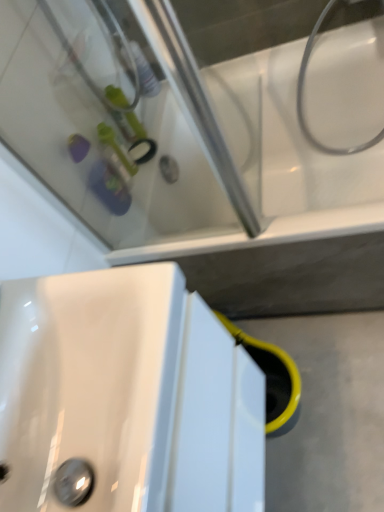
Image resolution: width=384 pixels, height=512 pixels. What do you see at coordinates (125, 397) in the screenshot? I see `white glossy sink at lower left` at bounding box center [125, 397].

What do you see at coordinates (202, 173) in the screenshot? The height and width of the screenshot is (512, 384). I see `white glossy bathtub at upper center` at bounding box center [202, 173].

Measure the distance between white glossy bathtub at upper center and camera.

white glossy bathtub at upper center is 34.36 inches away from camera.

I want to click on white glossy hose at upper right, so click(x=302, y=97).

Where is `white glossy sink at lower left`? white glossy sink at lower left is located at coordinates (125, 397).

Is white glossy bathtub at upper center oriented towards white glossy sink at lower left?

Yes.

From a real-world perspective, is white glossy bathtub at upper center positioned under white glossy sink at lower left based on gravity?

Yes, from a real-world perspective, white glossy bathtub at upper center is beneath white glossy sink at lower left.

Is white glossy bathtub at upper center not within white glossy sink at lower left?

Yes.

Which object is wider, white glossy bathtub at upper center or white glossy sink at lower left?

With larger width is white glossy bathtub at upper center.

You are a GUI agent. You are given a task and a screenshot of the screen. Output one action in this format:
    pyautogui.click(x=<x>, y=<y>)
    Task: Click on the plumbing fixture above the white glossy bathtub at upper center (from a real-world perspective)
    
    Given the screenshot: What is the action you would take?
    pyautogui.click(x=302, y=97)

Considering the sizes of objects white glossy hose at upper right and white glossy bathtub at upper center in the image provided, who is wider, white glossy hose at upper right or white glossy bathtub at upper center?

With larger width is white glossy bathtub at upper center.

From the picture: Considering the positions of objects white glossy hose at upper right and white glossy bathtub at upper center in the image provided, who is more to the left, white glossy hose at upper right or white glossy bathtub at upper center?

From the viewer's perspective, white glossy bathtub at upper center appears more on the left side.

From the image's perspective, which is below, white glossy hose at upper right or white glossy bathtub at upper center?

white glossy bathtub at upper center, from the image's perspective.

Relative to white glossy hose at upper right, is white glossy sink at lower left in front or behind?

Clearly, white glossy sink at lower left is in front of white glossy hose at upper right.

Considering the sizes of white glossy sink at lower left and white glossy hose at upper right in the image, is white glossy sink at lower left wider or thinner than white glossy hose at upper right?

In the image, white glossy sink at lower left appears to be wider than white glossy hose at upper right.

Is white glossy hose at upper right at the back of white glossy sink at lower left?

No, white glossy sink at lower left is not facing away from white glossy hose at upper right.

Considering the positions of point (31, 472) and point (316, 23), is point (31, 472) closer or farther from the camera than point (316, 23)?

Point (31, 472).

In terms of size, does white glossy hose at upper right appear bigger or smaller than white glossy sink at lower left?

Considering their sizes, white glossy hose at upper right takes up less space than white glossy sink at lower left.

Considering the relative sizes of white glossy hose at upper right and white glossy sink at lower left in the image provided, is white glossy hose at upper right thinner than white glossy sink at lower left?

Correct, the width of white glossy hose at upper right is less than that of white glossy sink at lower left.

What's the angular difference between white glossy hose at upper right and white glossy sink at lower left's facing directions?

89.2 degrees separate the facing orientations of white glossy hose at upper right and white glossy sink at lower left.

Would you consider white glossy hose at upper right to be distant from white glossy sink at lower left?

white glossy hose at upper right is far away from white glossy sink at lower left.

Between white glossy sink at lower left and white glossy bathtub at upper center, which one has less height?

Standing shorter between the two is white glossy bathtub at upper center.

Does white glossy sink at lower left lie in front of white glossy bathtub at upper center?

Yes, it is.

Between white glossy sink at lower left and white glossy bathtub at upper center, which one has smaller size?

Smaller between the two is white glossy sink at lower left.

Is white glossy sink at lower left to the left of white glossy bathtub at upper center from the viewer's perspective?

Correct, you'll find white glossy sink at lower left to the left of white glossy bathtub at upper center.

Does point (49, 172) come farther from viewer compared to point (308, 41)?

No, (49, 172) is closer to viewer.

In the scene shown: Considering the relative sizes of white glossy bathtub at upper center and white glossy hose at upper right in the image provided, is white glossy bathtub at upper center bigger than white glossy hose at upper right?

Yes.

How distant is white glossy bathtub at upper center from white glossy hose at upper right?

A distance of 41.87 centimeters exists between white glossy bathtub at upper center and white glossy hose at upper right.

Is white glossy bathtub at upper center at the left side of white glossy hose at upper right?

Yes, white glossy bathtub at upper center is to the left of white glossy hose at upper right.

In the image, there is a white glossy sink at lower left. Find the location of `bath above it (from the image's perspective)`. bath above it (from the image's perspective) is located at coordinates (202, 173).

Locate an element on the screen. This screenshot has width=384, height=512. plumbing fixture above the white glossy bathtub at upper center (from a real-world perspective) is located at coordinates (302, 97).

Looking at the image, which one is located closer to white glossy bathtub at upper center, white glossy hose at upper right or white glossy sink at lower left?

white glossy hose at upper right is positioned closer to the anchor white glossy bathtub at upper center.

Looking at the image, which one is located further to white glossy bathtub at upper center, white glossy sink at lower left or white glossy hose at upper right?

white glossy sink at lower left is further to white glossy bathtub at upper center.

Estimate the real-world distances between objects in this image. Which object is further from white glossy hose at upper right, white glossy sink at lower left or white glossy bathtub at upper center?

Based on the image, white glossy sink at lower left appears to be further to white glossy hose at upper right.

Considering their positions, is white glossy hose at upper right positioned further to white glossy sink at lower left than white glossy bathtub at upper center?

Among the two, white glossy hose at upper right is located further to white glossy sink at lower left.

Considering their positions, is white glossy bathtub at upper center positioned closer to white glossy sink at lower left than white glossy hose at upper right?

white glossy bathtub at upper center.

Estimate the real-world distances between objects in this image. Which object is closer to white glossy hose at upper right, white glossy bathtub at upper center or white glossy sink at lower left?

white glossy bathtub at upper center.

At what (x,y) coordinates should I click in order to perform the action: click on bath between white glossy hose at upper right and white glossy sink at lower left in the up-down direction. Please return your answer as a coordinate pair (x, y). The height and width of the screenshot is (512, 384). Looking at the image, I should click on (202, 173).